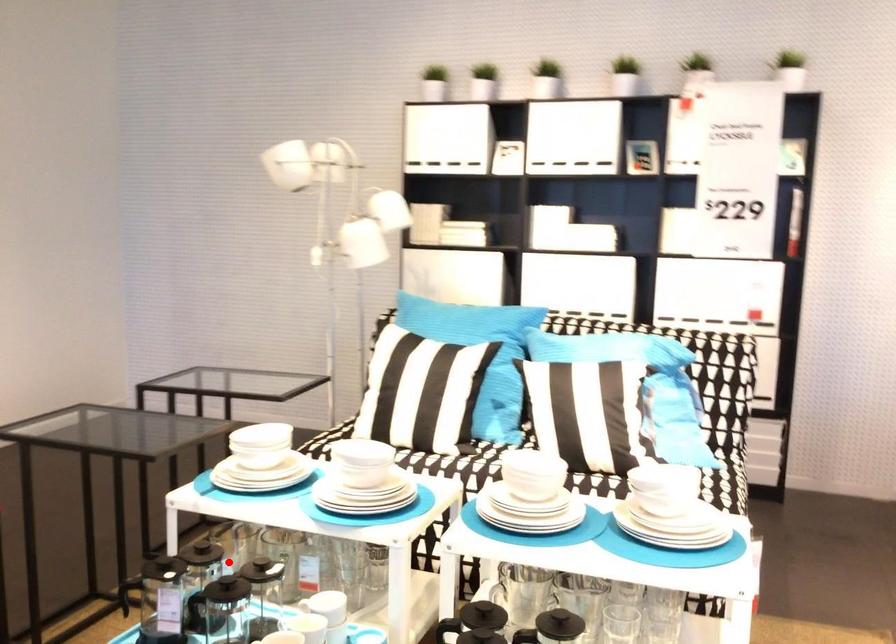
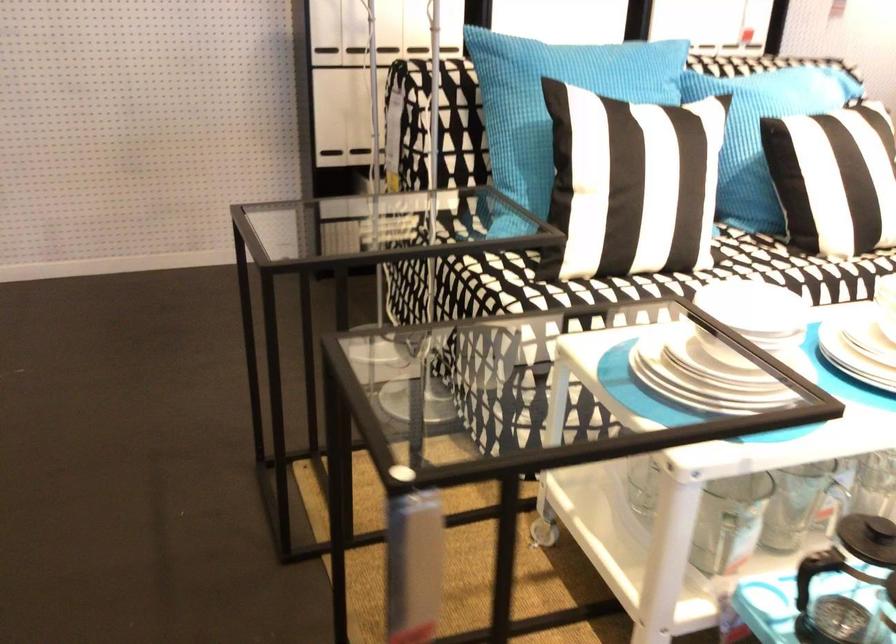
Find the pixel in the second image that matches the highlighted location in the first image.

(867, 538)